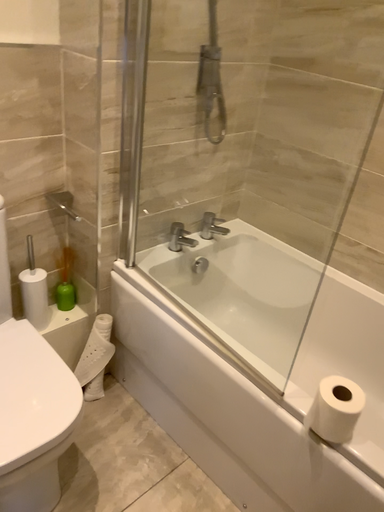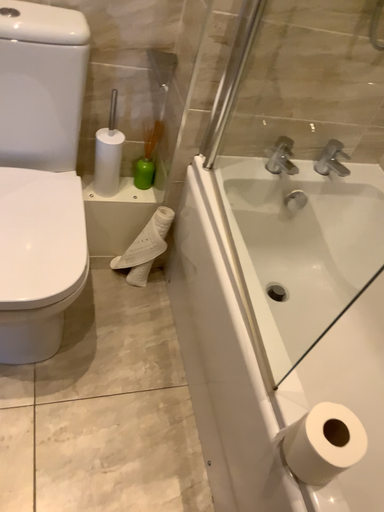
Question: How did the camera likely rotate when shooting the video?

Choices:
 (A) rotated downward
 (B) rotated upward

Answer: (A)